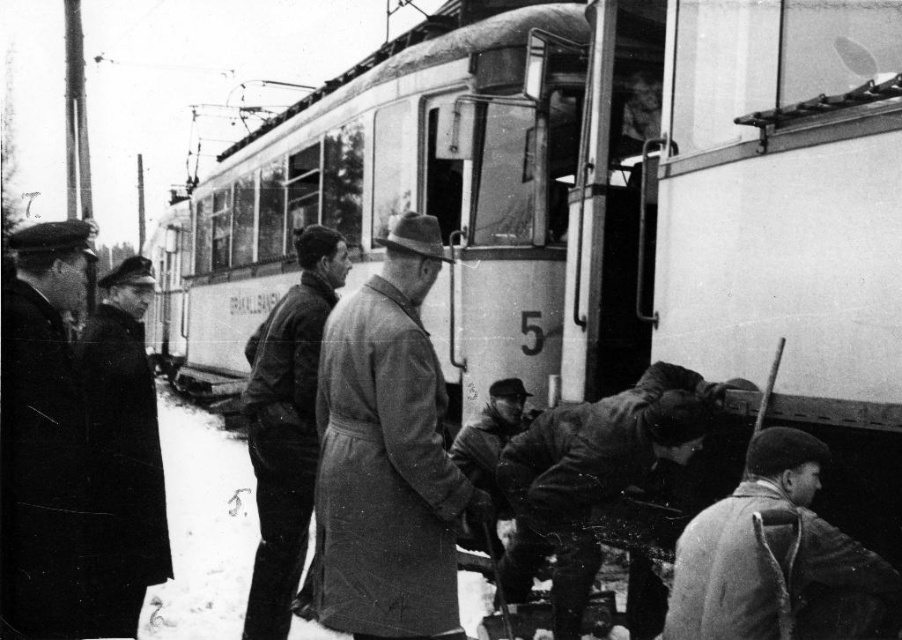
You are standing at the center of the image and want to move towards the dark brown leather jacket at lower right. Which direction should you move in?

You should move towards the lower right direction to reach the dark brown leather jacket at lower right since it is located at point (778, 557), which is in the lower right quadrant of the image.